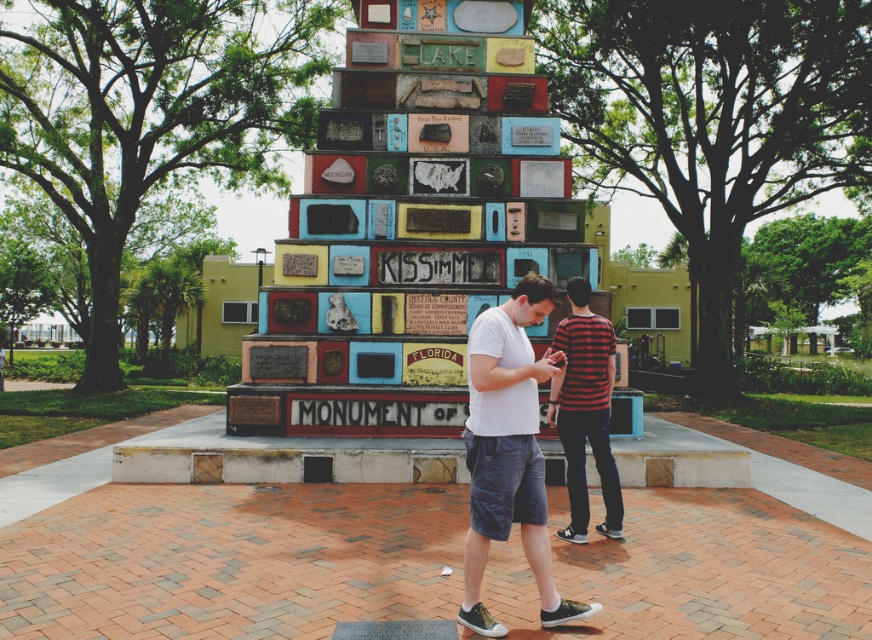
Can you confirm if white cotton t-shirt at center is positioned below striped cotton shirt at center?

Correct, white cotton t-shirt at center is located below striped cotton shirt at center.

Between point (529, 561) and point (598, 426), which one is positioned behind?

Positioned behind is point (598, 426).

Find the location of a particular element. white cotton t-shirt at center is located at coordinates (509, 451).